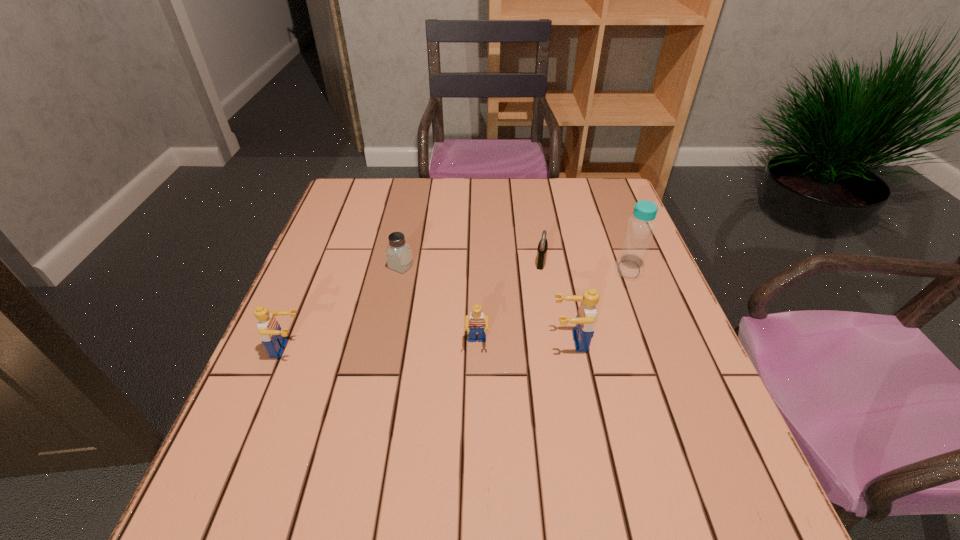
The height and width of the screenshot is (540, 960). I want to click on free space between the leftmost object and the second object from left to right, so click(344, 308).

The height and width of the screenshot is (540, 960). Find the location of `vacant region between the rightmost object and the saltshaker`. vacant region between the rightmost object and the saltshaker is located at coordinates (515, 268).

At what (x,y) coordinates should I click in order to perform the action: click on blank region between the fifth shortest object and the shortest Lego. Please return your answer as a coordinate pair (x, y). The width and height of the screenshot is (960, 540). Looking at the image, I should click on (524, 342).

I want to click on blank region between the padlock and the second object from left to right, so click(x=471, y=264).

Identify the location of unoccupied position between the second object from left to right and the tallest Lego. (486, 304).

Locate an element on the screen. The width and height of the screenshot is (960, 540). empty space between the padlock and the second tallest Lego is located at coordinates (414, 306).

Locate an element on the screen. free space between the second tallest object and the leftmost object is located at coordinates (429, 345).

Image resolution: width=960 pixels, height=540 pixels. In order to click on free space between the saltshaker and the bottle in this screenshot , I will do `click(515, 268)`.

Find the location of `object that stands as the third closest to the third object from left to right`. object that stands as the third closest to the third object from left to right is located at coordinates (543, 244).

Identify which object is the fourth nearest to the second Lego from left to right. Please provide its 2D coordinates. Your answer should be formatted as a tuple, i.e. [(x, y)], where the tuple contains the x and y coordinates of a point satisfying the conditions above.

[(269, 329)]